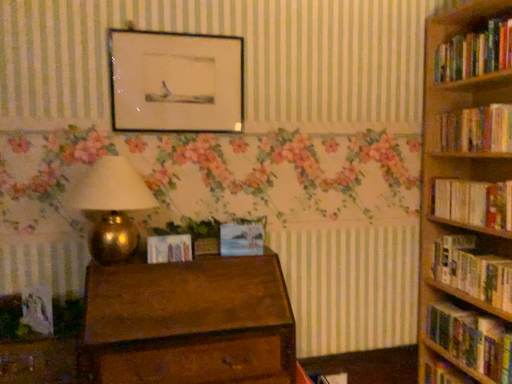
Find the location of a particular element. unoccupied region to the right of matte paper photo frame at center, which is counted as the 1th paperback book, starting from the left is located at coordinates (205, 259).